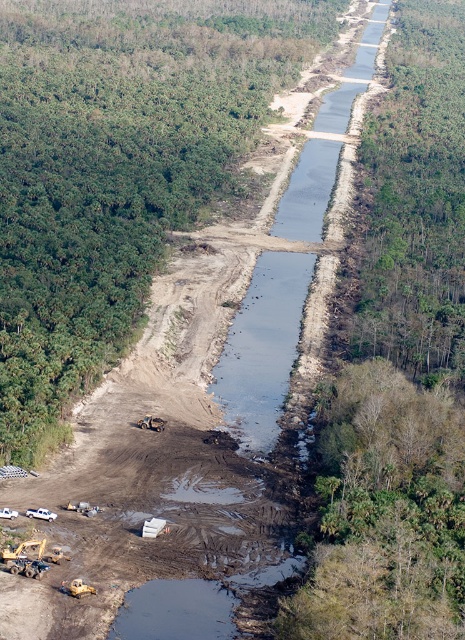
You are a construction worker standing at the edge of the canal. You see the yellow rubber at lower left and the metallic yellow excavator at lower left. Which object is closer to you?

The yellow rubber at lower left is closer to you because it is in front of the metallic yellow excavator at lower left.

You are a drone operator flying a drone over the canal. You need to navigate between the two points, point [65,592] and point [159,429]. Which point is closer to the drone when it is positioned at the starting point near the forest edge?

Point [65,592] is in front of point [159,429], so the drone will be closer to point [65,592] when positioned at the starting point near the forest edge.

You are a construction worker standing at the center of the canal. You need to place a new yellow rubber at the exact location where the existing yellow rubber at lower left is currently located. According to the coordinates provided, where should you place the new yellow rubber?

The yellow rubber at lower left is located at coordinates point (77, 588), so you should place the new yellow rubber at the same point (77, 588).